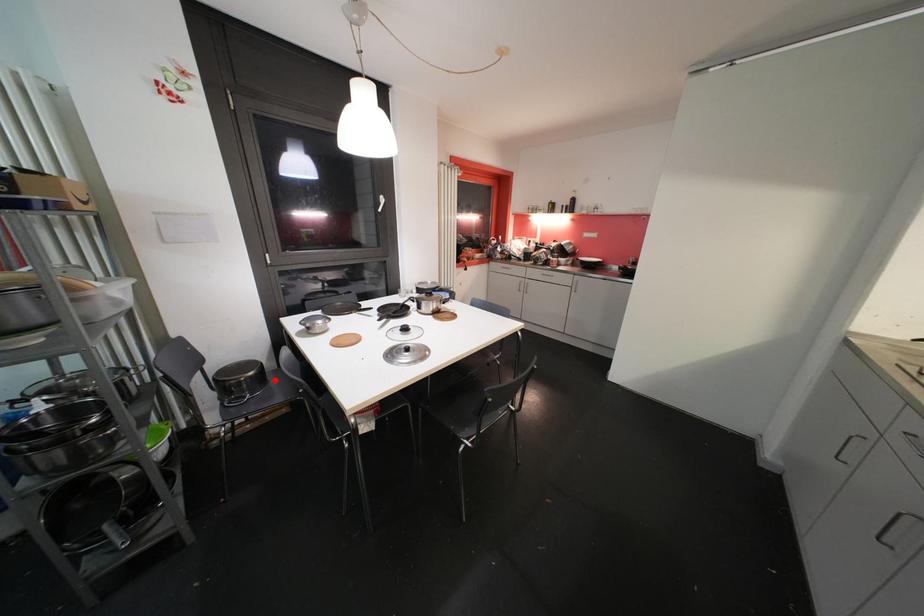
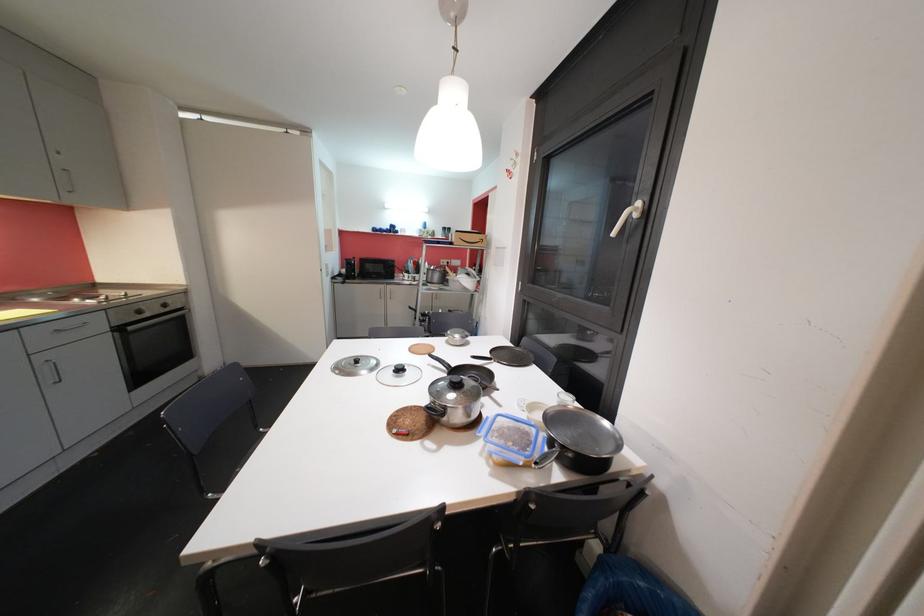
Question: I am providing you with two images of the same scene from different viewpoints. A red point is marked on the first image. Is the red point's position out of view in image 2?

Choices:
 (A) Yes
 (B) No

Answer: (A)